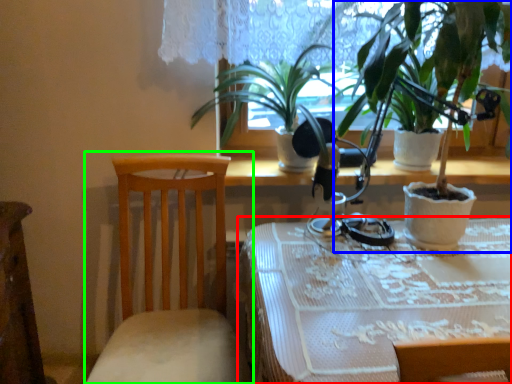
Question: Estimate the real-world distances between objects in this image. Which object is closer to table (highlighted by a red box), houseplant (highlighted by a blue box) or chair (highlighted by a green box)?

Choices:
 (A) houseplant
 (B) chair

Answer: (B)